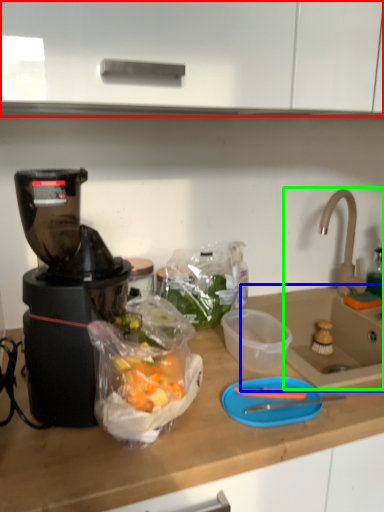
Question: Estimate the real-world distances between objects in this image. Which object is farther from cabinetry (highlighted by a red box), sink (highlighted by a blue box) or sink (highlighted by a green box)?

Choices:
 (A) sink
 (B) sink

Answer: (A)